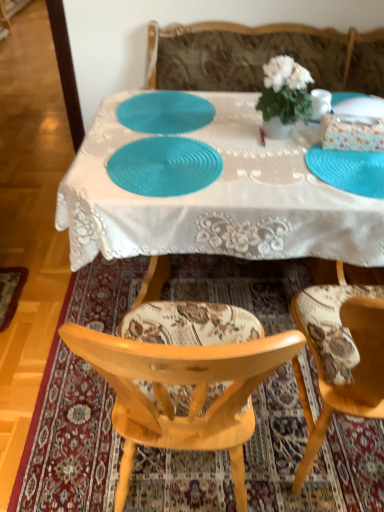
At what (x,y) coordinates should I click in order to perform the action: click on free region under patterned fabric chair at center (from a real-world perspective). Please return your answer as a coordinate pair (x, y). This screenshot has height=512, width=384. Looking at the image, I should click on (324, 435).